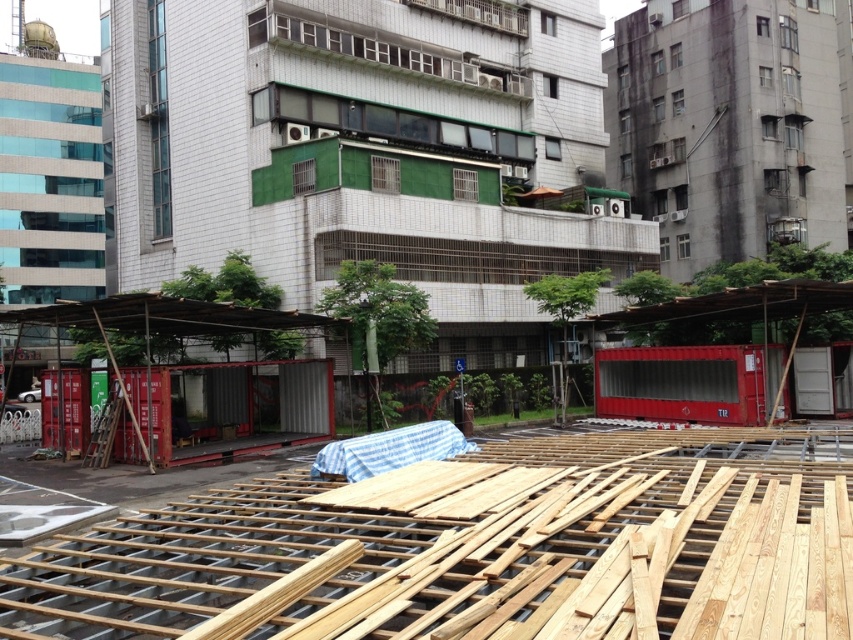
You are a delivery truck driver who needs to unload a cargo box that is 2 meters in length. You are currently at the metallic shipping container at center and want to place the cargo box next to the natural wood planks at center. Is there enough space between them to place the cargo box?

The distance between the metallic shipping container at center and natural wood planks at center is 18.48 meters, so there is more than enough space to place the 2 meter long cargo box between them.

You are a delivery truck driver who needs to park your truck between the large pile of wooden planks and beams in the foreground and the metallic shipping container at center. Can you fit your truck, which is 60 feet long, in that space?

The space between the large pile of wooden planks and beams in the foreground and the metallic shipping container at center is 66.93 feet. Since your truck is 60 feet long, it can fit in that space.